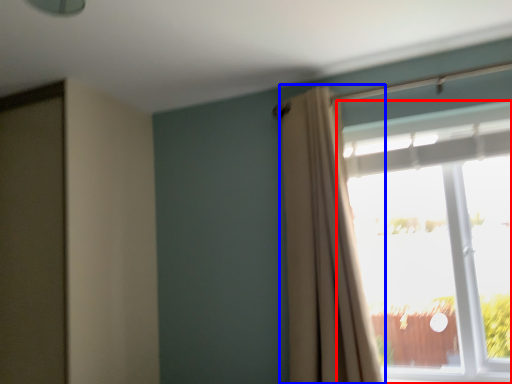
Question: Among these objects, which one is farthest to the camera, window (highlighted by a red box) or curtain (highlighted by a blue box)?

Choices:
 (A) window
 (B) curtain

Answer: (A)